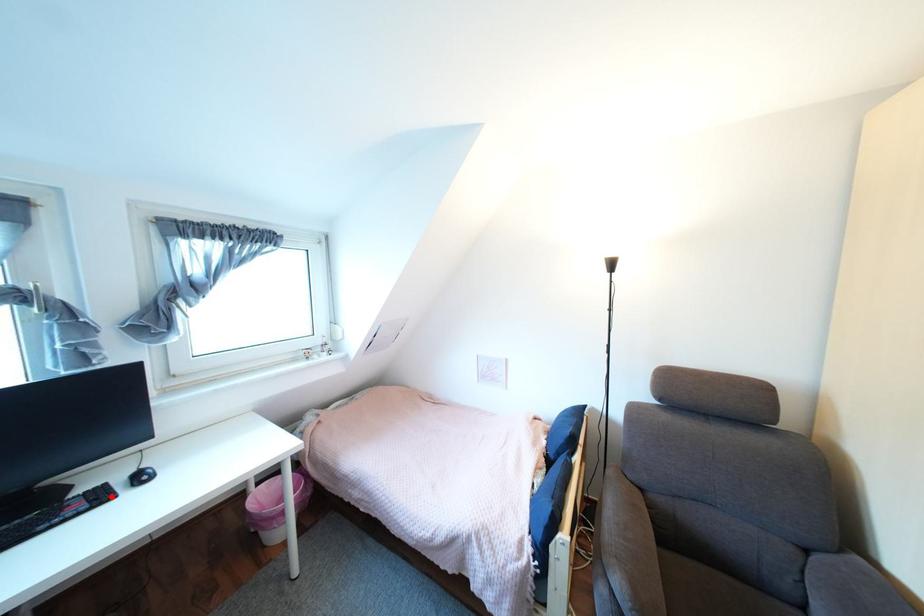
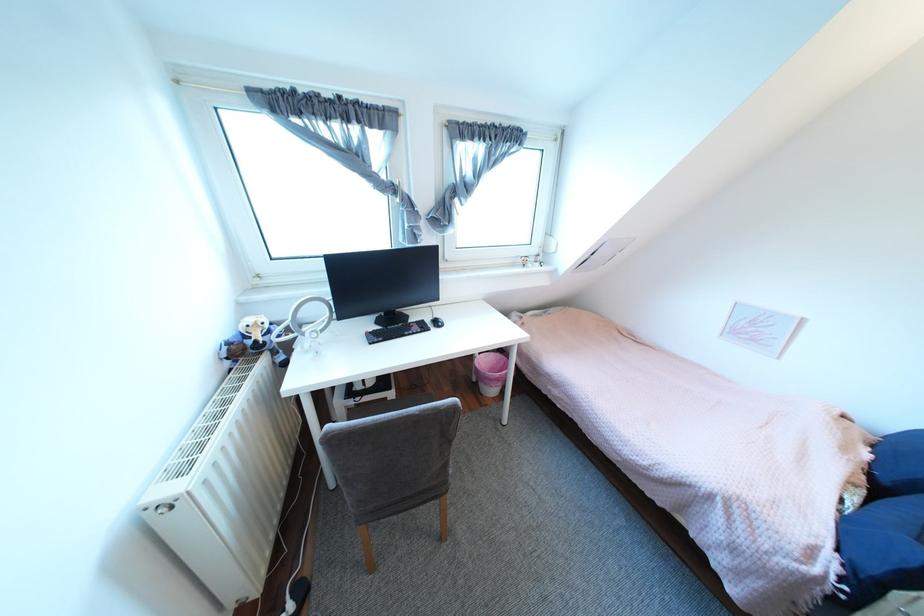
The point at the highlighted location is marked in the first image. Where is the corresponding point in the second image?

(433, 326)